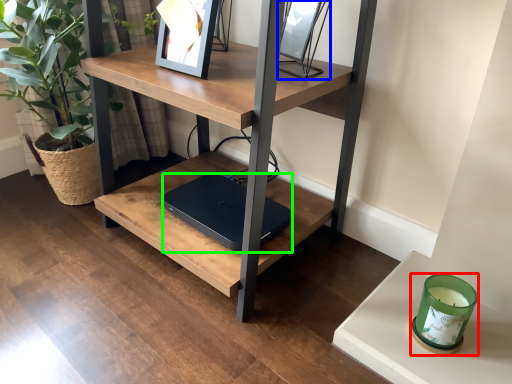
Question: Which object is the farthest from candle holder (highlighted by a red box)? Choose among these: picture frame (highlighted by a blue box) or laptop (highlighted by a green box).

Choices:
 (A) picture frame
 (B) laptop

Answer: (A)